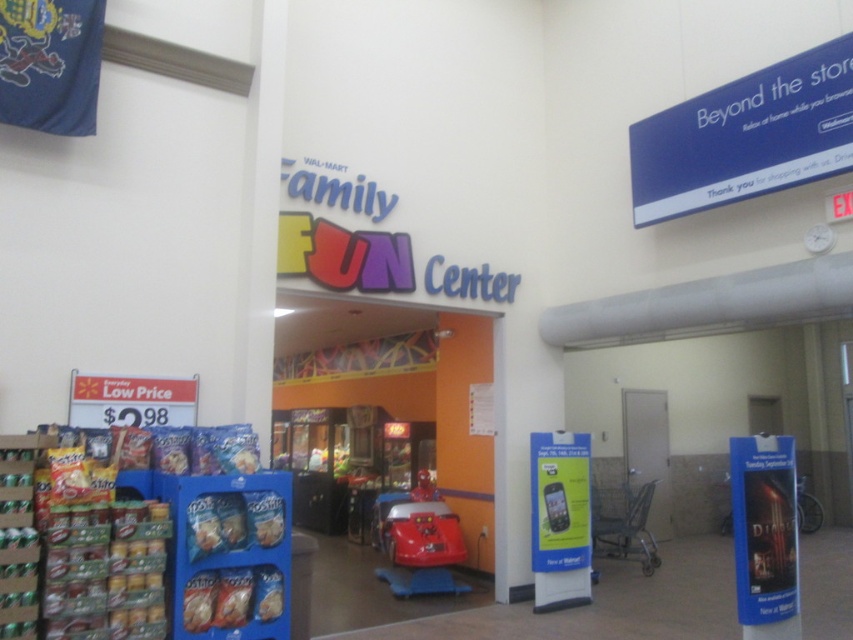
From the picture: You are a customer in the Family Fun Center at Walmart. You see a yellow glossy phone at center and a shiny red car at center. Which object is taller?

The yellow glossy phone at center is taller than the shiny red car at center.

You are a customer in the Walmart Family Fun Center. You see the black glossy poster at lower right and the yellow glossy phone at center. Which object is closer to you?

The black glossy poster at lower right is closer to you because it is in front of the yellow glossy phone at center.